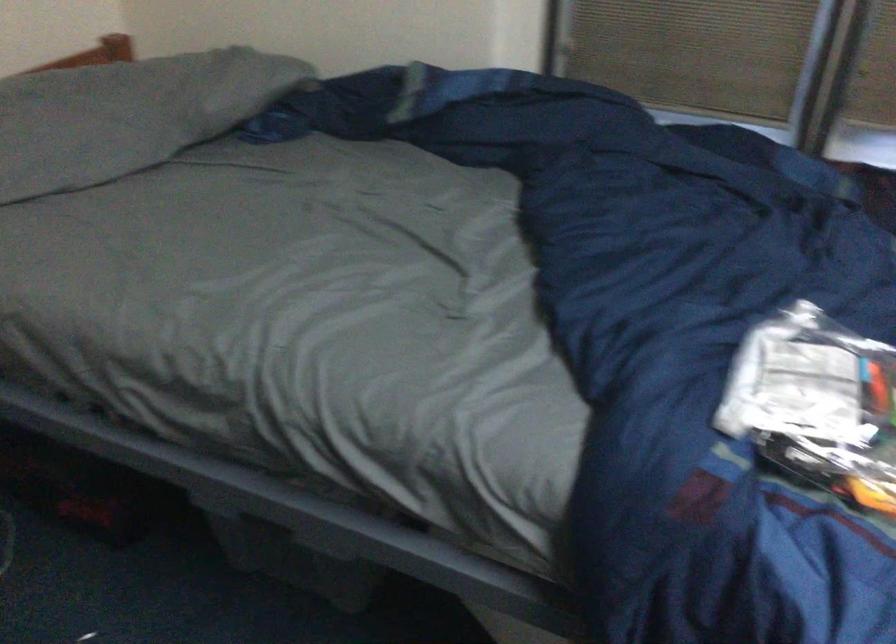
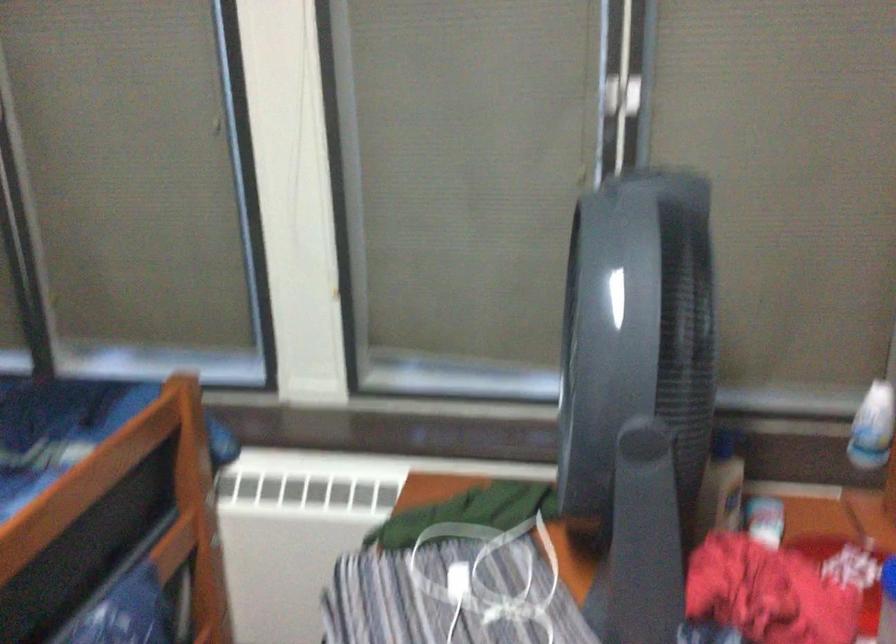
Question: In a continuous first-person perspective shot, in which direction is the camera moving?

Choices:
 (A) Left
 (B) Right
 (C) Forward
 (D) Backward

Answer: (B)